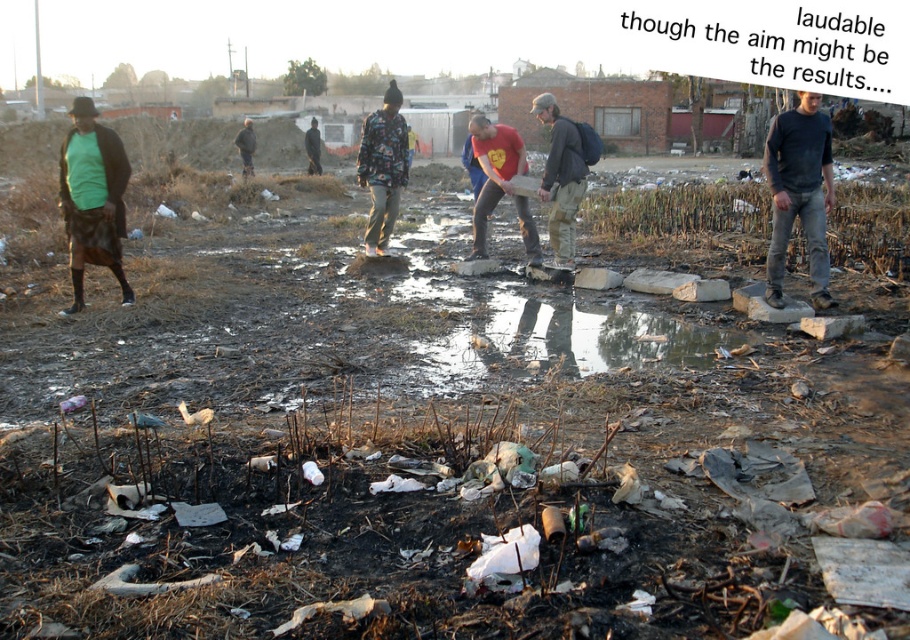
Looking at this image, can you confirm if green matte shirt at left is smaller than matte gray jacket at center?

Correct, green matte shirt at left occupies less space than matte gray jacket at center.

Is green matte shirt at left positioned in front of matte gray jacket at center?

Yes, it is.

Does point (119, 252) lie behind point (555, 264)?

No, it is not.

I want to click on green matte shirt at left, so click(x=92, y=196).

Is glossy concrete puddle at center further to the viewer compared to dark gray t-shirt at center?

No, it is not.

Between point (577, 323) and point (810, 170), which one is positioned behind?

The point (577, 323) is more distant.

Is point (457, 300) less distant than point (814, 266)?

No, it is not.

Find the location of a particular element. The height and width of the screenshot is (640, 910). glossy concrete puddle at center is located at coordinates (546, 333).

Looking at this image, is floral-patterned jacket at center wider than dark brown jacket at center?

Yes.

Does floral-patterned jacket at center have a larger size compared to dark brown jacket at center?

Correct, floral-patterned jacket at center is larger in size than dark brown jacket at center.

Identify the location of floral-patterned jacket at center. pos(382,168).